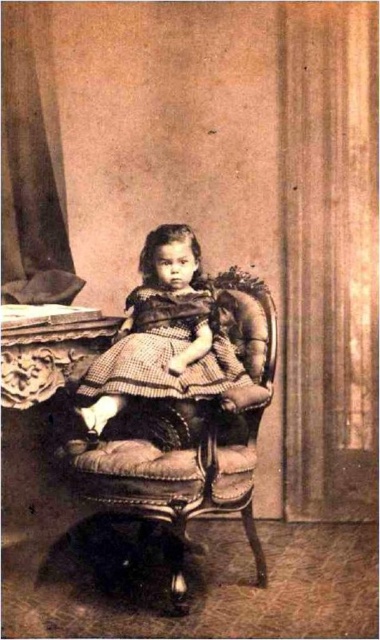
Can you confirm if matte brown dress at center is wider than checkered fabric dress at center?

Yes, matte brown dress at center is wider than checkered fabric dress at center.

Does point (134, 369) come closer to viewer compared to point (107, 364)?

That is True.

Between point (199, 352) and point (137, 330), which one is positioned behind?

Point (137, 330)

Find the location of a particular element. The image size is (380, 640). matte brown dress at center is located at coordinates (167, 337).

Is point (250, 525) positioned behind point (175, 369)?

Yes, it is.

Is point (231, 330) in front of point (191, 355)?

That is False.

You are a GUI agent. You are given a task and a screenshot of the screen. Output one action in this format:
    pyautogui.click(x=<x>, y=<y>)
    Task: Click on the velvet upholstered armchair at center
    Image resolution: width=380 pixels, height=640 pixels.
    Given the screenshot: What is the action you would take?
    pyautogui.click(x=191, y=435)

Can you confirm if velvet upholstered armchair at center is wider than checkered fabric dress at center?

Indeed, velvet upholstered armchair at center has a greater width compared to checkered fabric dress at center.

Between point (169, 529) and point (153, 307), which one is positioned in front?

Positioned in front is point (153, 307).

What do you see at coordinates (191, 435) in the screenshot? The image size is (380, 640). I see `velvet upholstered armchair at center` at bounding box center [191, 435].

Locate an element on the screen. This screenshot has width=380, height=640. velvet upholstered armchair at center is located at coordinates (191, 435).